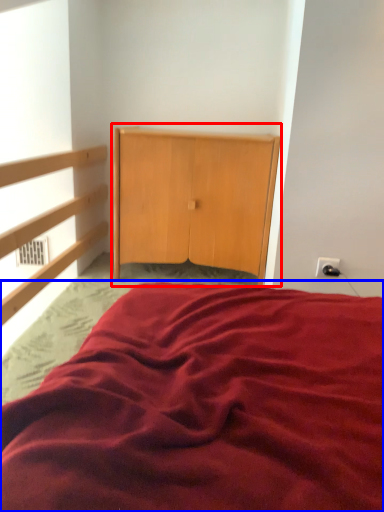
Question: Which of the following is the closest to the observer, dresser (highlighted by a red box) or bed (highlighted by a blue box)?

Choices:
 (A) dresser
 (B) bed

Answer: (B)